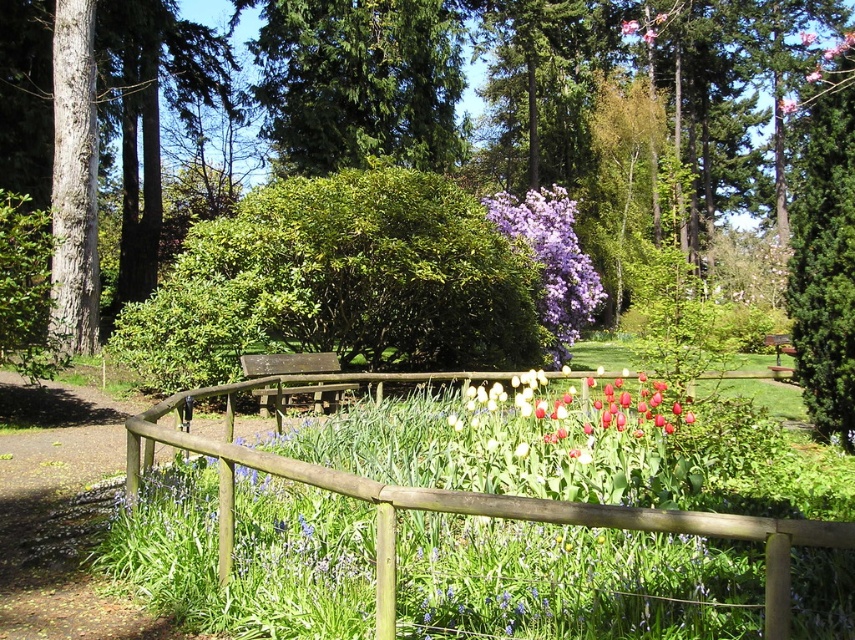
Question: Which of these objects is positioned farthest from the wooden bench at center?

Choices:
 (A) matte red tulip at center
 (B) green textured tree at upper center
 (C) purple matte flower at upper center

Answer: (C)

Question: Which of the following is the farthest from the observer?

Choices:
 (A) green textured tree at upper center
 (B) wooden fence at center
 (C) purple matte flower at upper center
 (D) green leafy bush at center

Answer: (C)

Question: Is green leafy bush at center above wooden bench at center?

Choices:
 (A) no
 (B) yes

Answer: (B)

Question: Is the position of matte red tulip at center less distant than that of purple matte flower at upper center?

Choices:
 (A) yes
 (B) no

Answer: (A)

Question: Among these points, which one is nearest to the camera?

Choices:
 (A) (314, 4)
 (B) (540, 310)
 (C) (320, 364)
 (D) (500, 276)

Answer: (C)

Question: In this image, where is matte red tulip at center located relative to purple matte flower at upper center?

Choices:
 (A) left
 (B) right

Answer: (A)